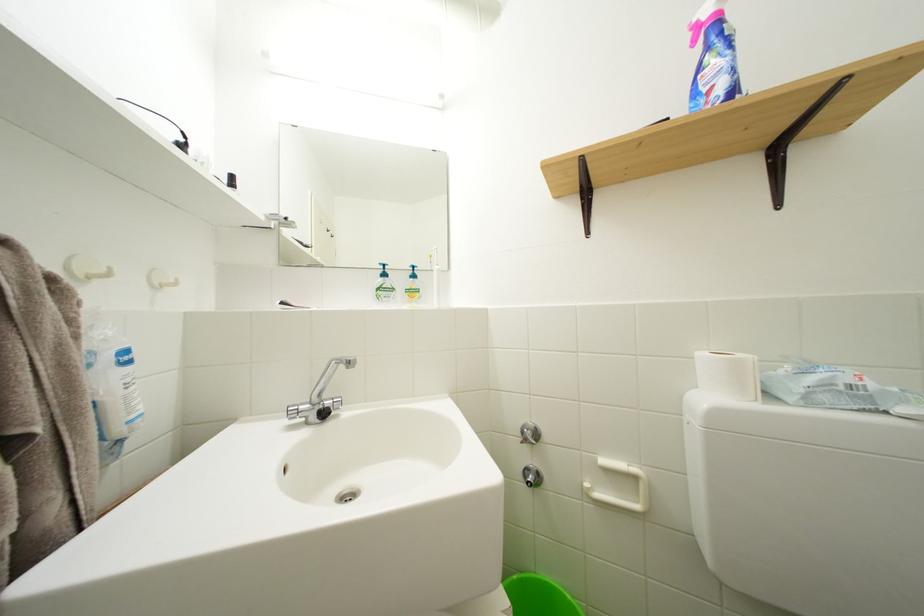
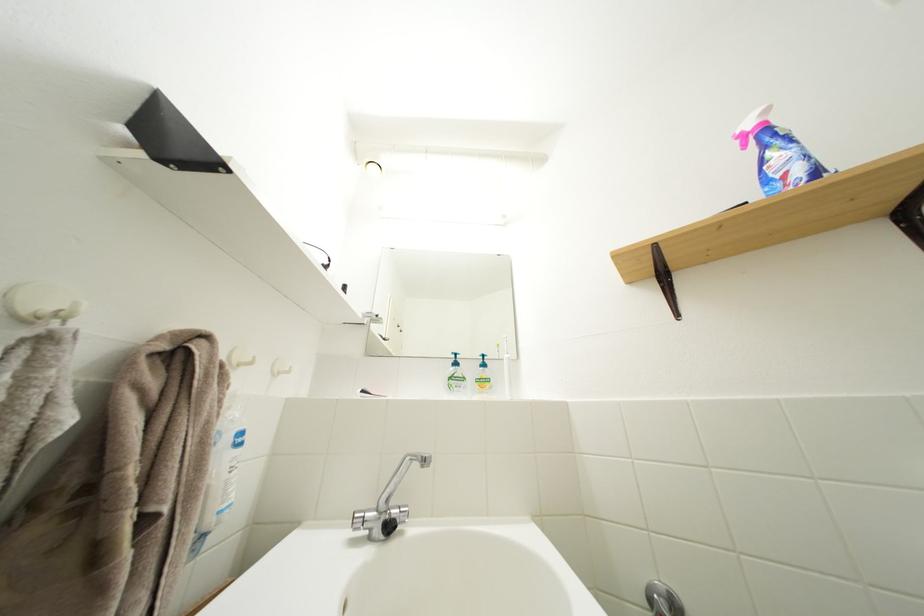
Locate, in the second image, the point that corresponds to (408,286) in the first image.

(479, 376)